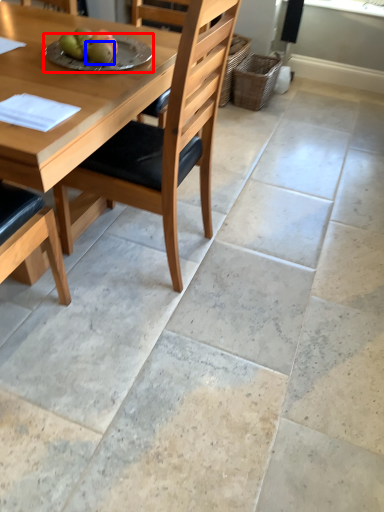
Question: Which point is further to the camera, plate (highlighted by a red box) or fruit (highlighted by a blue box)?

Choices:
 (A) plate
 (B) fruit

Answer: (A)